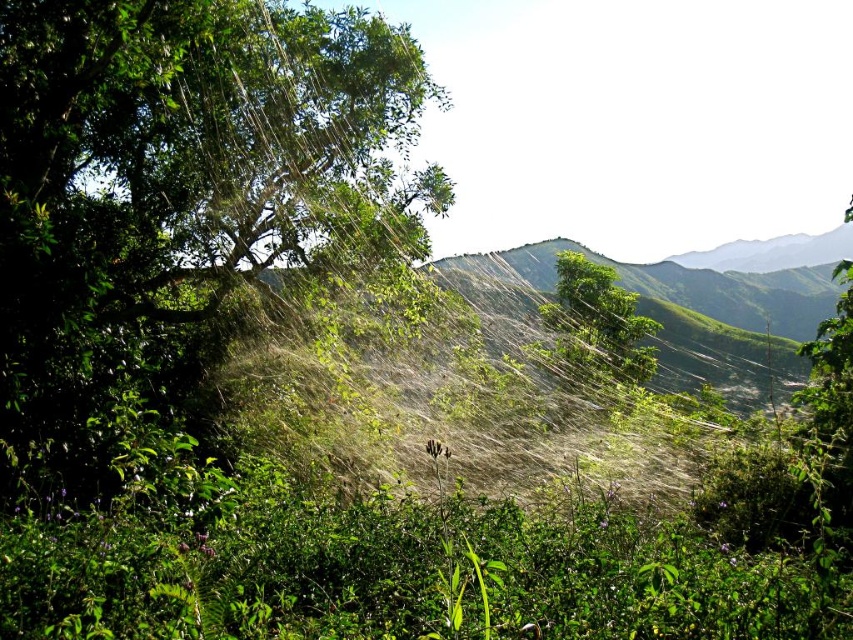
Question: Is green leafy tree at upper left thinner than green leafy tree at center?

Choices:
 (A) yes
 (B) no

Answer: (A)

Question: Which object is closer to the camera taking this photo?

Choices:
 (A) green leafy tree at upper left
 (B) green leafy tree at center

Answer: (A)

Question: Which of the following is the closest to the observer?

Choices:
 (A) (6, 468)
 (B) (570, 339)

Answer: (A)

Question: From the image, what is the correct spatial relationship of green leafy tree at upper left in relation to green leafy tree at center?

Choices:
 (A) left
 (B) right

Answer: (A)

Question: Can you confirm if green leafy tree at upper left is thinner than green leafy tree at center?

Choices:
 (A) no
 (B) yes

Answer: (B)